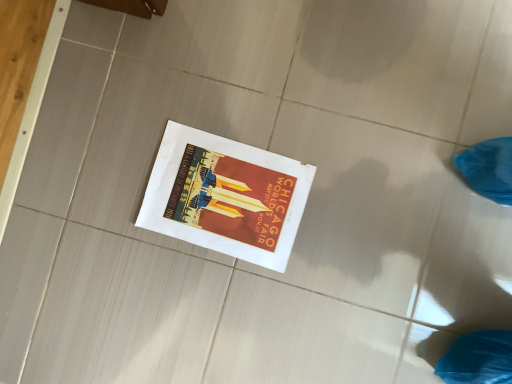
Locate an element on the screen. This screenshot has width=512, height=384. white paper poster at center is located at coordinates (226, 196).

Image resolution: width=512 pixels, height=384 pixels. Describe the element at coordinates (226, 196) in the screenshot. I see `white paper poster at center` at that location.

Image resolution: width=512 pixels, height=384 pixels. I want to click on white paper poster at center, so click(226, 196).